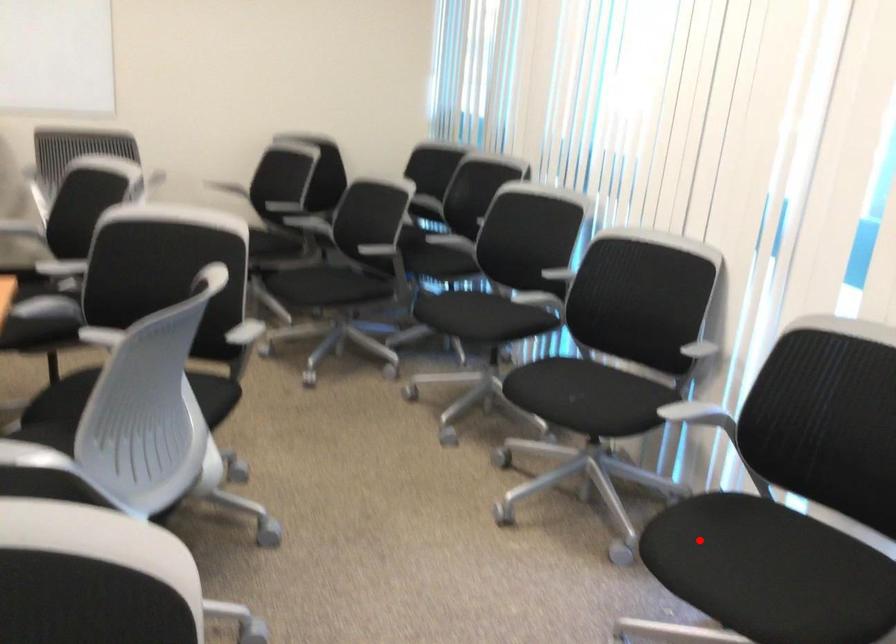
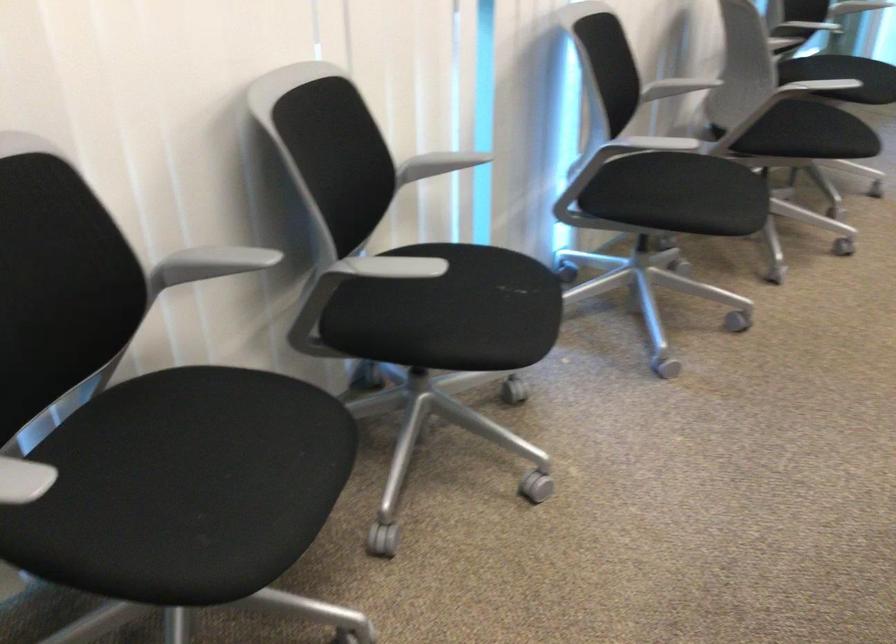
In the second image, find the point that corresponds to the highlighted location in the first image.

(679, 194)